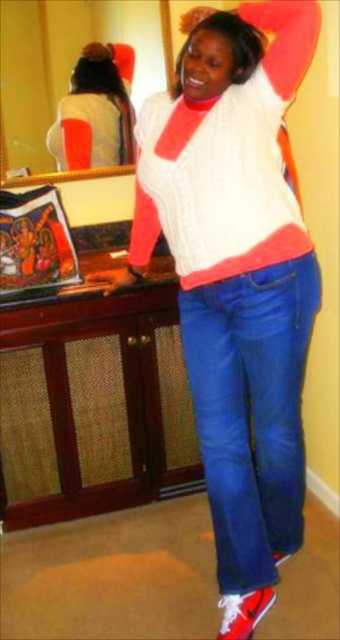
You are an interior designer examining the room layout. You need to place a small decorative item exactly at the point with coordinates point (236, 278). What object will this decorative item be placed on?

The point (236, 278) corresponds to the white knit sweater at center, so the decorative item will be placed on the white knit sweater at center.

You are a fashion designer observing a model wearing denim jeans at lower center and white knit sweater at upper center. Which piece of clothing is positioned more to the right?

The denim jeans at lower center is positioned more to the right than the white knit sweater at upper center.